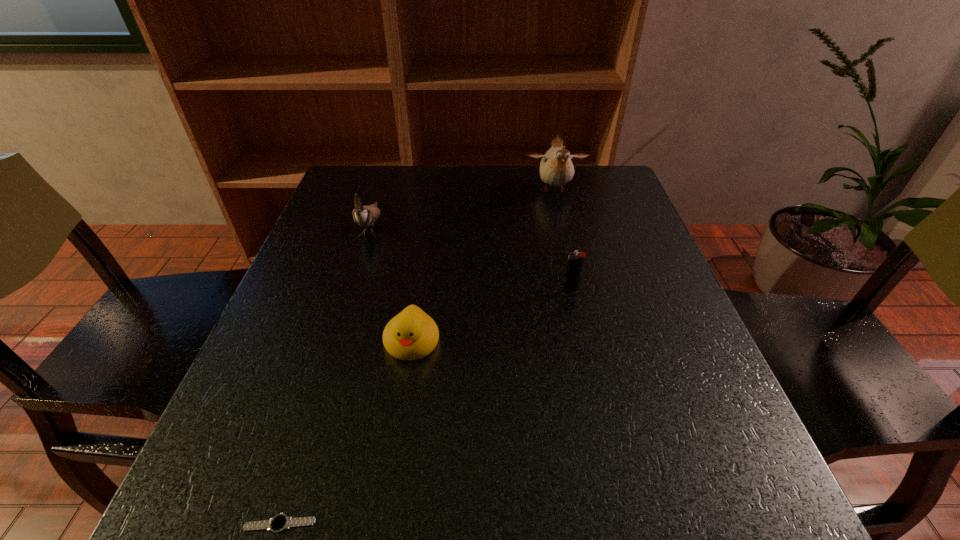
The width and height of the screenshot is (960, 540). I want to click on object that is positioned at the near left corner, so click(279, 523).

Locate an element on the screen. Image resolution: width=960 pixels, height=540 pixels. object at the far right corner is located at coordinates (556, 167).

Where is `free location at the far edge`? This screenshot has height=540, width=960. free location at the far edge is located at coordinates (444, 178).

Identify the location of free spot at the near edge of the desktop. This screenshot has height=540, width=960. (479, 488).

You are a GUI agent. You are given a task and a screenshot of the screen. Output one action in this format:
    pyautogui.click(x=<x>, y=<y>)
    Task: Click on the free region at the left edge of the desktop
    This screenshot has width=960, height=540.
    Given the screenshot: What is the action you would take?
    pyautogui.click(x=303, y=251)

At what (x,y) coordinates should I click in order to perform the action: click on free space at the far right corner. Please return your answer as a coordinate pair (x, y). This screenshot has width=960, height=540. Looking at the image, I should click on (617, 207).

Find the location of a particular element. vacant space in between the farther bird and the third shortest object is located at coordinates (563, 241).

Locate an element on the screen. free spot between the left bird and the third farthest object is located at coordinates (470, 259).

Identify the location of unoccupied area between the nearer bird and the taller bird. (463, 208).

The width and height of the screenshot is (960, 540). I want to click on free space that is in between the farthest object and the fourth shortest object, so click(x=463, y=208).